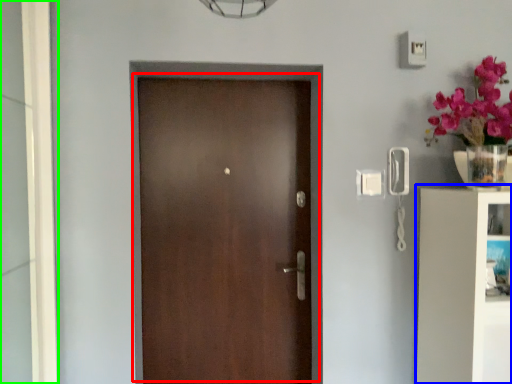
Question: Based on their relative distances, which object is farther from door (highlighted by a red box)? Choose from bookshelf (highlighted by a blue box) and glass door (highlighted by a green box).

Choices:
 (A) bookshelf
 (B) glass door

Answer: (A)